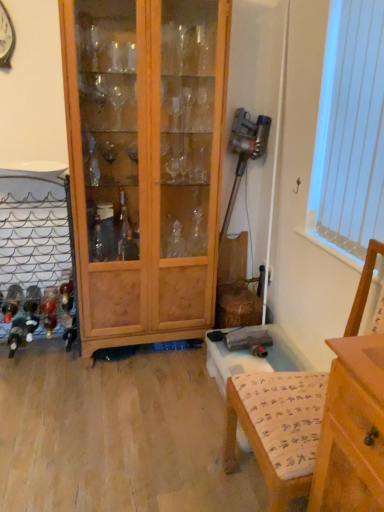
Question: Is wooden cabinet at center outside white vertical blinds at upper right?

Choices:
 (A) yes
 (B) no

Answer: (A)

Question: Does wooden cabinet at center have a larger size compared to white vertical blinds at upper right?

Choices:
 (A) no
 (B) yes

Answer: (B)

Question: Is white vertical blinds at upper right inside wooden cabinet at center?

Choices:
 (A) yes
 (B) no

Answer: (B)

Question: Is wooden cabinet at center at the right side of white vertical blinds at upper right?

Choices:
 (A) yes
 (B) no

Answer: (B)

Question: From the image's perspective, is wooden cabinet at center beneath white vertical blinds at upper right?

Choices:
 (A) yes
 (B) no

Answer: (A)

Question: Considering the positions of wooden armchair at lower right and wooden cabinet at center in the image, is wooden armchair at lower right wider or thinner than wooden cabinet at center?

Choices:
 (A) wide
 (B) thin

Answer: (A)

Question: From a real-world perspective, is wooden armchair at lower right physically located above or below wooden cabinet at center?

Choices:
 (A) below
 (B) above

Answer: (A)

Question: Based on their sizes in the image, would you say wooden armchair at lower right is bigger or smaller than wooden cabinet at center?

Choices:
 (A) small
 (B) big

Answer: (A)

Question: Is point (324, 389) positioned closer to the camera than point (115, 46)?

Choices:
 (A) farther
 (B) closer

Answer: (B)

Question: Looking at the image, does white vertical blinds at upper right seem bigger or smaller compared to wooden cabinet at center?

Choices:
 (A) small
 (B) big

Answer: (A)

Question: Choose the correct answer: Is white vertical blinds at upper right inside wooden cabinet at center or outside it?

Choices:
 (A) inside
 (B) outside

Answer: (B)

Question: Considering the positions of white vertical blinds at upper right and wooden cabinet at center in the image, is white vertical blinds at upper right wider or thinner than wooden cabinet at center?

Choices:
 (A) wide
 (B) thin

Answer: (B)

Question: From a real-world perspective, relative to wooden cabinet at center, is white vertical blinds at upper right vertically above or below?

Choices:
 (A) below
 (B) above

Answer: (B)

Question: Is wooden cabinet at center taller or shorter than wooden armchair at lower right?

Choices:
 (A) tall
 (B) short

Answer: (A)

Question: From the image's perspective, is wooden cabinet at center above or below wooden armchair at lower right?

Choices:
 (A) above
 (B) below

Answer: (A)